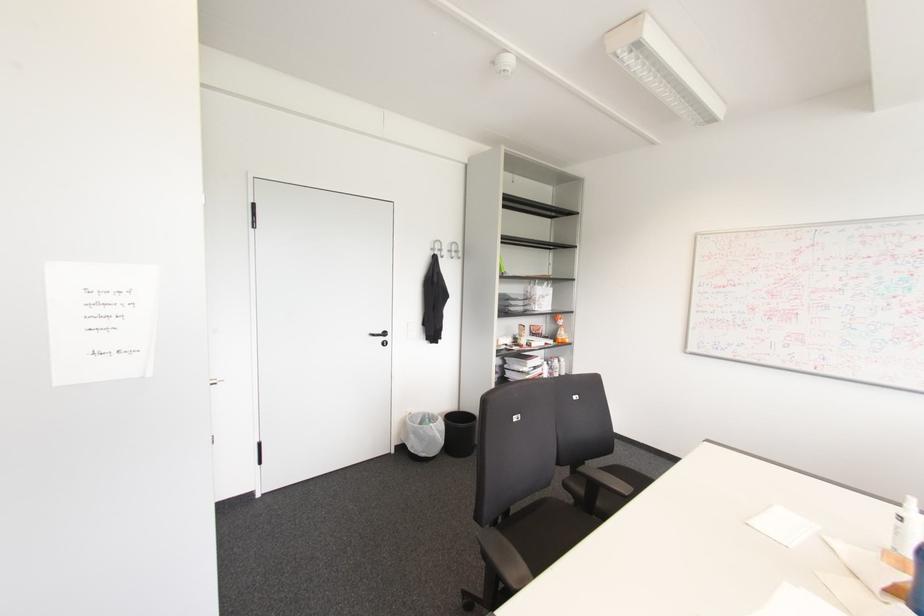
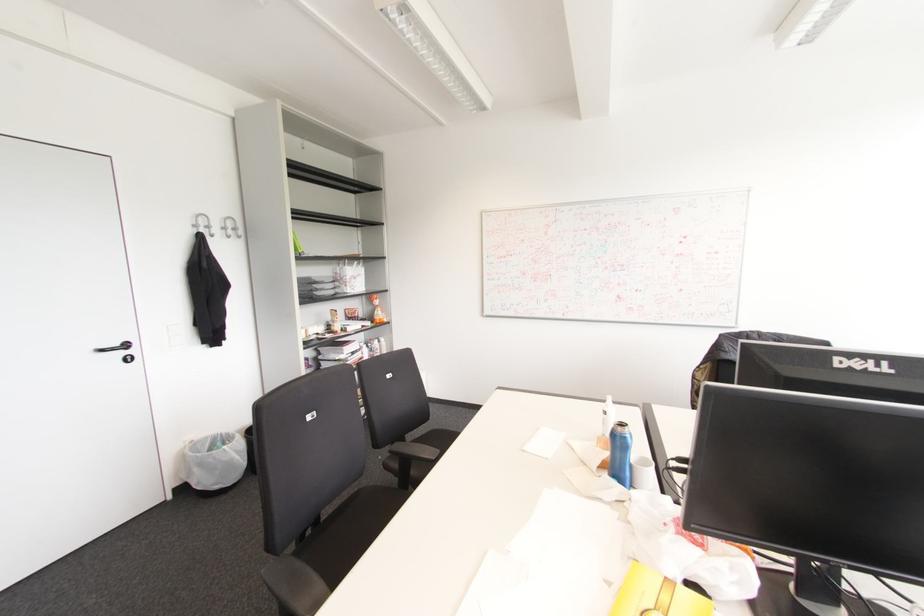
Where in the second image is the point corresponding to point (383, 333) from the first image?

(126, 345)